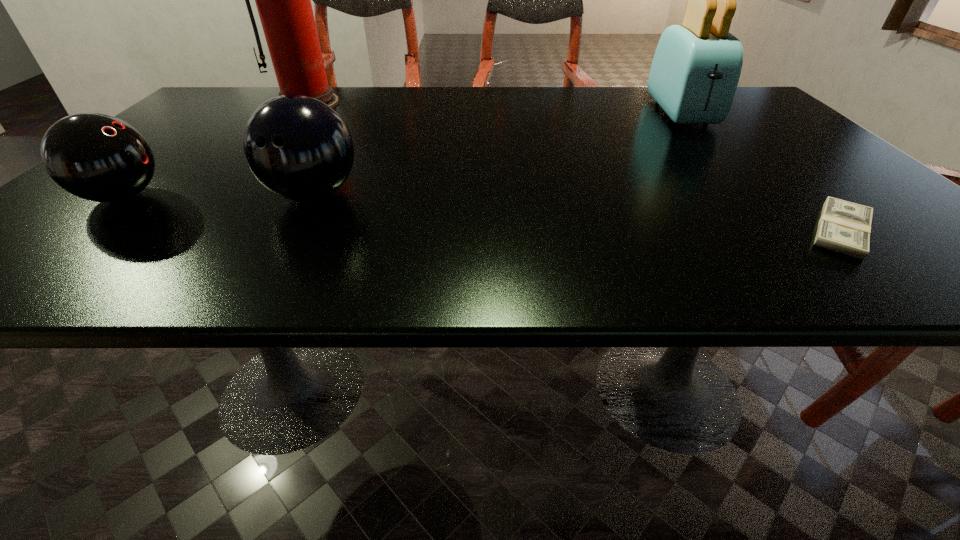
In order to click on vacant area that lies between the dollar and the second tallest object in this screenshot , I will do `click(761, 171)`.

Where is `free space between the dollar and the right bowling ball`? The height and width of the screenshot is (540, 960). free space between the dollar and the right bowling ball is located at coordinates (577, 212).

In order to click on unoccupied position between the left bowling ball and the dollar in this screenshot , I will do `click(483, 213)`.

Select which object appears as the second closest to the tallest object. Please provide its 2D coordinates. Your answer should be formatted as a tuple, i.e. [(x, y)], where the tuple contains the x and y coordinates of a point satisfying the conditions above.

[(97, 157)]

Point out which object is positioned as the second nearest to the dollar. Please provide its 2D coordinates. Your answer should be formatted as a tuple, i.e. [(x, y)], where the tuple contains the x and y coordinates of a point satisfying the conditions above.

[(299, 148)]

Image resolution: width=960 pixels, height=540 pixels. In order to click on vacant space that satisfies the following two spatial constraints: 1. on the side of the shortest object with the finger holes; 2. on the left side of the right bowling ball in this screenshot , I will do `click(294, 230)`.

At what (x,y) coordinates should I click in order to perform the action: click on vacant space that satisfies the following two spatial constraints: 1. on the side of the second tallest object with the lever; 2. on the surface of the left bowling ball near the finger holes. Please return your answer as a coordinate pair (x, y). The height and width of the screenshot is (540, 960). Looking at the image, I should click on (759, 197).

The width and height of the screenshot is (960, 540). In order to click on free region that satisfies the following two spatial constraints: 1. on the side of the toaster with the lever; 2. on the surface of the shorter bowling ball near the finger holes in this screenshot , I will do `click(759, 197)`.

The width and height of the screenshot is (960, 540). Identify the location of free spot that satisfies the following two spatial constraints: 1. on the surface of the shortest object near the finger holes; 2. on the right side of the leftmost object. (84, 230).

The image size is (960, 540). What are the coordinates of `free space that satisfies the following two spatial constraints: 1. on the side of the toaster with the lever; 2. on the surface of the leftmost object near the finger holes` in the screenshot? It's located at (759, 197).